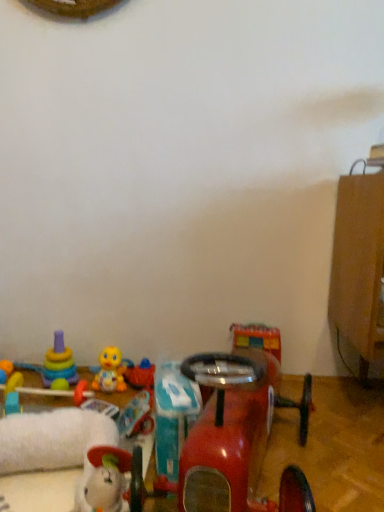
What do you see at coordinates (76, 455) in the screenshot? The height and width of the screenshot is (512, 384). I see `white plush toy at lower left, which is counted as the 5th toy, starting from the right` at bounding box center [76, 455].

Describe the element at coordinates (172, 420) in the screenshot. I see `teal plastic toy at center, the 6th toy from the left` at that location.

What do you see at coordinates (239, 431) in the screenshot?
I see `glossy plastic toy car at lower center, marked as the first toy in a right-to-left arrangement` at bounding box center [239, 431].

Where is `yellow rubber duck at center, positioned as the 4th toy in right-to-left order`? Image resolution: width=384 pixels, height=512 pixels. yellow rubber duck at center, positioned as the 4th toy in right-to-left order is located at coordinates (110, 371).

Identify the location of white plush toy at lower left, which is the third toy from left to right. This screenshot has height=512, width=384. [x=76, y=455].

How distant is matte yellow toy at lower left, the seventh toy from the right, from glossy plastic toy car at lower center, which is counted as the seventh toy, starting from the left?

The distance of matte yellow toy at lower left, the seventh toy from the right, from glossy plastic toy car at lower center, which is counted as the seventh toy, starting from the left, is 37.91 inches.

What's the angular difference between matte yellow toy at lower left, the seventh toy from the right, and glossy plastic toy car at lower center, marked as the first toy in a right-to-left arrangement,'s facing directions?

They differ by 93.7 degrees in their facing directions.

Considering the sizes of matte yellow toy at lower left, the seventh toy from the right, and glossy plastic toy car at lower center, which is counted as the seventh toy, starting from the left, in the image, is matte yellow toy at lower left, the seventh toy from the right, taller or shorter than glossy plastic toy car at lower center, which is counted as the seventh toy, starting from the left,?

Clearly, matte yellow toy at lower left, the seventh toy from the right, is shorter compared to glossy plastic toy car at lower center, which is counted as the seventh toy, starting from the left.

Is matte yellow toy at lower left, the seventh toy from the right, oriented towards glossy plastic toy car at lower center, marked as the first toy in a right-to-left arrangement?

No, matte yellow toy at lower left, the seventh toy from the right, is not facing towards glossy plastic toy car at lower center, marked as the first toy in a right-to-left arrangement.

Is yellow rubber duck at center, positioned as the 4th toy in right-to-left order, wider than matte yellow toy at lower left, which is the 1th toy from left to right?

Yes.

I want to click on toy that is the 3rd one when counting backward from the yellow rubber duck at center, positioned as the 4th toy in right-to-left order, so click(5, 370).

Is yellow rubber duck at center, positioned as the 4th toy in right-to-left order, with matte yellow toy at lower left, the seventh toy from the right?

No, yellow rubber duck at center, positioned as the 4th toy in right-to-left order, is not making contact with matte yellow toy at lower left, the seventh toy from the right.

From the image's perspective, would you say yellow rubber duck at center, placed as the fourth toy when sorted from left to right, is shown under matte yellow toy at lower left, the seventh toy from the right?

No.

From the image's perspective, is teal plastic toy at center, marked as the 2th toy in a right-to-left arrangement, located beneath glossy plastic toy car at lower center, marked as the first toy in a right-to-left arrangement?

Actually, teal plastic toy at center, marked as the 2th toy in a right-to-left arrangement, appears above glossy plastic toy car at lower center, marked as the first toy in a right-to-left arrangement, in the image.

Is teal plastic toy at center, marked as the 2th toy in a right-to-left arrangement, far from glossy plastic toy car at lower center, which is counted as the seventh toy, starting from the left?

They are positioned close to each other.

Which of these two, teal plastic toy at center, marked as the 2th toy in a right-to-left arrangement, or glossy plastic toy car at lower center, marked as the first toy in a right-to-left arrangement, is smaller?

teal plastic toy at center, marked as the 2th toy in a right-to-left arrangement.

Is teal plastic toy at center, marked as the 2th toy in a right-to-left arrangement, oriented towards glossy plastic toy car at lower center, marked as the first toy in a right-to-left arrangement?

No, teal plastic toy at center, marked as the 2th toy in a right-to-left arrangement, is not oriented towards glossy plastic toy car at lower center, marked as the first toy in a right-to-left arrangement.

From a real-world perspective, is yellow rubber duck at center, positioned as the 4th toy in right-to-left order, on top of rubber duck at center, arranged as the 3th toy when viewed from the right?

Yes, from a real-world perspective, yellow rubber duck at center, positioned as the 4th toy in right-to-left order, is above rubber duck at center, arranged as the 3th toy when viewed from the right.

Does yellow rubber duck at center, placed as the fourth toy when sorted from left to right, turn towards rubber duck at center, which appears as the 5th toy when viewed from the left?

No, yellow rubber duck at center, placed as the fourth toy when sorted from left to right, does not turn towards rubber duck at center, which appears as the 5th toy when viewed from the left.

Can you tell me how much yellow rubber duck at center, placed as the fourth toy when sorted from left to right, and rubber duck at center, which appears as the 5th toy when viewed from the left, differ in facing direction?

There is a 0.268-degree angle between the facing directions of yellow rubber duck at center, placed as the fourth toy when sorted from left to right, and rubber duck at center, which appears as the 5th toy when viewed from the left.

From the image's perspective, is yellow rubber duck at center, positioned as the 4th toy in right-to-left order, on top of rubber duck at center, arranged as the 3th toy when viewed from the right?

Yes.

Based on the photo, from a real-world perspective, which is physically below, glossy plastic toy car at lower center, which is counted as the seventh toy, starting from the left, or rubber duck at center, which appears as the 5th toy when viewed from the left?

In real-world perspective, glossy plastic toy car at lower center, which is counted as the seventh toy, starting from the left, is lower.

Is glossy plastic toy car at lower center, marked as the first toy in a right-to-left arrangement, oriented away from rubber duck at center, arranged as the 3th toy when viewed from the right?

No, glossy plastic toy car at lower center, marked as the first toy in a right-to-left arrangement, is not facing the opposite direction of rubber duck at center, arranged as the 3th toy when viewed from the right.

Considering the relative positions of glossy plastic toy car at lower center, marked as the first toy in a right-to-left arrangement, and rubber duck at center, arranged as the 3th toy when viewed from the right, in the image provided, is glossy plastic toy car at lower center, marked as the first toy in a right-to-left arrangement, to the left or to the right of rubber duck at center, arranged as the 3th toy when viewed from the right,?

glossy plastic toy car at lower center, marked as the first toy in a right-to-left arrangement, is positioned on rubber duck at center, arranged as the 3th toy when viewed from the right,'s right side.

Is yellow rubber duck at center, positioned as the 4th toy in right-to-left order, to the left of stacked plastic rings at lower left, marked as the sixth toy in a right-to-left arrangement, from the viewer's perspective?

Incorrect, yellow rubber duck at center, positioned as the 4th toy in right-to-left order, is not on the left side of stacked plastic rings at lower left, marked as the sixth toy in a right-to-left arrangement.

Choose the correct answer: Is yellow rubber duck at center, placed as the fourth toy when sorted from left to right, inside stacked plastic rings at lower left, placed as the 2th toy when sorted from left to right, or outside it?

yellow rubber duck at center, placed as the fourth toy when sorted from left to right, is not enclosed by stacked plastic rings at lower left, placed as the 2th toy when sorted from left to right.

From a real-world perspective, is yellow rubber duck at center, placed as the fourth toy when sorted from left to right, located higher than stacked plastic rings at lower left, placed as the 2th toy when sorted from left to right?

No, from a real-world perspective, yellow rubber duck at center, placed as the fourth toy when sorted from left to right, is not over stacked plastic rings at lower left, placed as the 2th toy when sorted from left to right

Can you confirm if glossy plastic toy car at lower center, which is counted as the seventh toy, starting from the left, is wider than yellow rubber duck at center, placed as the fourth toy when sorted from left to right?

Yes, glossy plastic toy car at lower center, which is counted as the seventh toy, starting from the left, is wider than yellow rubber duck at center, placed as the fourth toy when sorted from left to right.

From a real-world perspective, between glossy plastic toy car at lower center, marked as the first toy in a right-to-left arrangement, and yellow rubber duck at center, positioned as the 4th toy in right-to-left order, who is vertically lower?

glossy plastic toy car at lower center, marked as the first toy in a right-to-left arrangement, is physically lower.

Measure the distance from glossy plastic toy car at lower center, which is counted as the seventh toy, starting from the left, to yellow rubber duck at center, placed as the fourth toy when sorted from left to right.

glossy plastic toy car at lower center, which is counted as the seventh toy, starting from the left, is 60.77 centimeters away from yellow rubber duck at center, placed as the fourth toy when sorted from left to right.

Looking at this image, is glossy plastic toy car at lower center, marked as the first toy in a right-to-left arrangement, not within yellow rubber duck at center, placed as the fourth toy when sorted from left to right?

That's correct, glossy plastic toy car at lower center, marked as the first toy in a right-to-left arrangement, is outside of yellow rubber duck at center, placed as the fourth toy when sorted from left to right.

From the glossy plastic toy car at lower center, which is counted as the seventh toy, starting from the left, count 6th toys backward and point to it. Please provide its 2D coordinates.

[(5, 370)]

At what (x,y) coordinates should I click in order to perform the action: click on toy that is the 3rd object above the matte yellow toy at lower left, which is the 1th toy from left to right (from a real-world perspective). Please return your answer as a coordinate pair (x, y). Image resolution: width=384 pixels, height=512 pixels. Looking at the image, I should click on (110, 371).

When comparing their distances from glossy plastic toy car at lower center, which is counted as the seventh toy, starting from the left, does stacked plastic rings at lower left, placed as the 2th toy when sorted from left to right, or rubber duck at center, arranged as the 3th toy when viewed from the right, seem closer?

Based on the image, rubber duck at center, arranged as the 3th toy when viewed from the right, appears to be nearer to glossy plastic toy car at lower center, which is counted as the seventh toy, starting from the left.

Based on their spatial positions, is matte yellow toy at lower left, which is the 1th toy from left to right, or rubber duck at center, which appears as the 5th toy when viewed from the left, closer to teal plastic toy at center, the 6th toy from the left?

rubber duck at center, which appears as the 5th toy when viewed from the left, is closer to teal plastic toy at center, the 6th toy from the left.

Consider the image. When comparing their distances from white plush toy at lower left, which is counted as the 5th toy, starting from the right, does teal plastic toy at center, the 6th toy from the left, or matte yellow toy at lower left, which is the 1th toy from left to right, seem closer?

teal plastic toy at center, the 6th toy from the left, lies closer to white plush toy at lower left, which is counted as the 5th toy, starting from the right, than the other object.

From the image, which object appears to be farther from teal plastic toy at center, the 6th toy from the left, matte yellow toy at lower left, the seventh toy from the right, or yellow rubber duck at center, placed as the fourth toy when sorted from left to right?

matte yellow toy at lower left, the seventh toy from the right, lies further to teal plastic toy at center, the 6th toy from the left, than the other object.

Estimate the real-world distances between objects in this image. Which object is further from matte yellow toy at lower left, which is the 1th toy from left to right, rubber duck at center, which appears as the 5th toy when viewed from the left, or yellow rubber duck at center, placed as the fourth toy when sorted from left to right?

Based on the image, rubber duck at center, which appears as the 5th toy when viewed from the left, appears to be further to matte yellow toy at lower left, which is the 1th toy from left to right.

Considering their positions, is teal plastic toy at center, marked as the 2th toy in a right-to-left arrangement, positioned closer to glossy plastic toy car at lower center, marked as the first toy in a right-to-left arrangement, than stacked plastic rings at lower left, marked as the sixth toy in a right-to-left arrangement?

Based on the image, teal plastic toy at center, marked as the 2th toy in a right-to-left arrangement, appears to be nearer to glossy plastic toy car at lower center, marked as the first toy in a right-to-left arrangement.

From the image, which object appears to be farther from white plush toy at lower left, which is the third toy from left to right, matte yellow toy at lower left, the seventh toy from the right, or glossy plastic toy car at lower center, which is counted as the seventh toy, starting from the left?

matte yellow toy at lower left, the seventh toy from the right, lies further to white plush toy at lower left, which is the third toy from left to right, than the other object.

Estimate the real-world distances between objects in this image. Which object is closer to yellow rubber duck at center, positioned as the 4th toy in right-to-left order, glossy plastic toy car at lower center, which is counted as the seventh toy, starting from the left, or stacked plastic rings at lower left, marked as the sixth toy in a right-to-left arrangement?

Based on the image, stacked plastic rings at lower left, marked as the sixth toy in a right-to-left arrangement, appears to be nearer to yellow rubber duck at center, positioned as the 4th toy in right-to-left order.

Where is `toy located between teal plastic toy at center, the 6th toy from the left, and rubber duck at center, arranged as the 3th toy when viewed from the right, in the depth direction`? The height and width of the screenshot is (512, 384). toy located between teal plastic toy at center, the 6th toy from the left, and rubber duck at center, arranged as the 3th toy when viewed from the right, in the depth direction is located at coordinates (110, 371).

This screenshot has height=512, width=384. In order to click on toy between white plush toy at lower left, which is counted as the 5th toy, starting from the right, and yellow rubber duck at center, positioned as the 4th toy in right-to-left order, along the z-axis in this screenshot , I will do `click(172, 420)`.